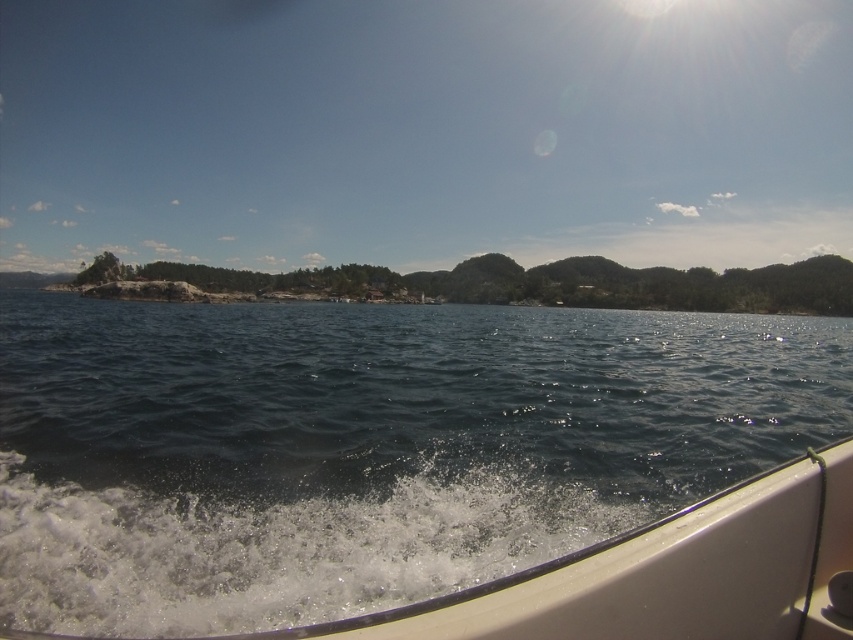
Locate an element on the screen. Image resolution: width=853 pixels, height=640 pixels. dark blue water at center is located at coordinates (364, 448).

Measure the distance between dark blue water at center and transparent blue sky at upper center.

A distance of 198.85 meters exists between dark blue water at center and transparent blue sky at upper center.

Does point (129, 371) come behind point (590, 154)?

No, it is not.

Find the location of a particular element. The height and width of the screenshot is (640, 853). dark blue water at center is located at coordinates (364, 448).